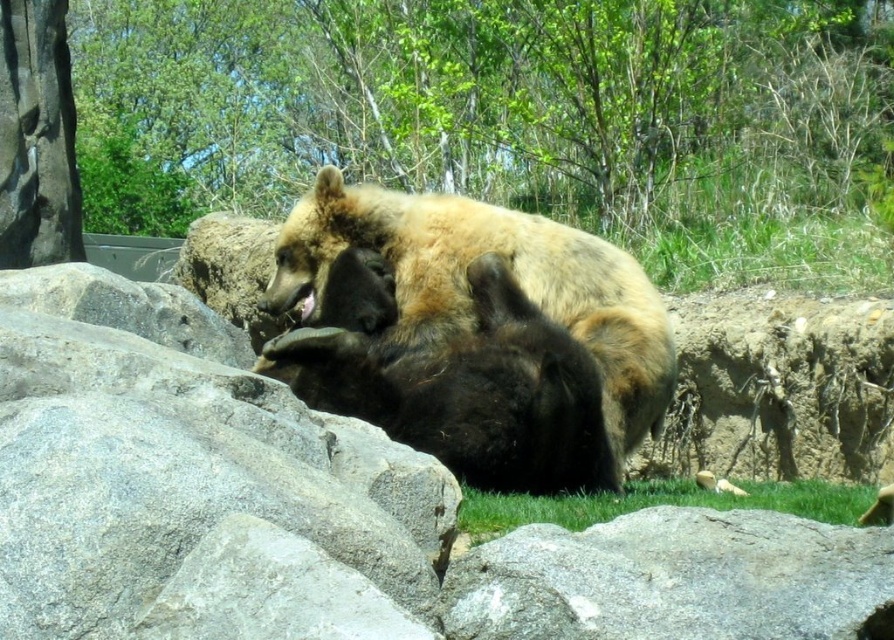
Question: Among these points, which one is farthest from the camera?

Choices:
 (A) (569, 282)
 (B) (580, 636)
 (C) (241, 19)
 (D) (505, 515)

Answer: (C)

Question: Does gray rough rock at lower center lie in front of green grass at lower center?

Choices:
 (A) yes
 (B) no

Answer: (A)

Question: Does green leafy tree at upper center have a larger size compared to gray rough rock at lower center?

Choices:
 (A) no
 (B) yes

Answer: (B)

Question: Which is farther from the green grass at lower center?

Choices:
 (A) gray rough rock at lower center
 (B) green leafy tree at upper center

Answer: (B)

Question: Among these objects, which one is nearest to the camera?

Choices:
 (A) gray rough rock at lower center
 (B) green grass at lower center

Answer: (A)

Question: Does gray rough rock at lower center appear under green grass at lower center?

Choices:
 (A) no
 (B) yes

Answer: (A)